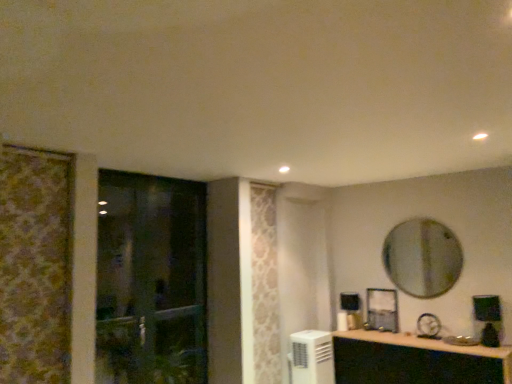
Question: From their relative heights in the image, would you say white plastic air conditioner at lower center is taller or shorter than transparent glass door at left?

Choices:
 (A) tall
 (B) short

Answer: (B)

Question: Considering the positions of white plastic air conditioner at lower center and transparent glass door at left in the image, is white plastic air conditioner at lower center wider or thinner than transparent glass door at left?

Choices:
 (A) thin
 (B) wide

Answer: (B)

Question: Which object is the closest to the matte black cabinet at lower right?

Choices:
 (A) silver metallic mirror at upper right
 (B) transparent glass door at left
 (C) white plastic air conditioner at lower center

Answer: (C)

Question: Estimate the real-world distances between objects in this image. Which object is closer to the matte black cabinet at lower right?

Choices:
 (A) silver metallic mirror at upper right
 (B) white plastic air conditioner at lower center
 (C) transparent glass door at left

Answer: (B)